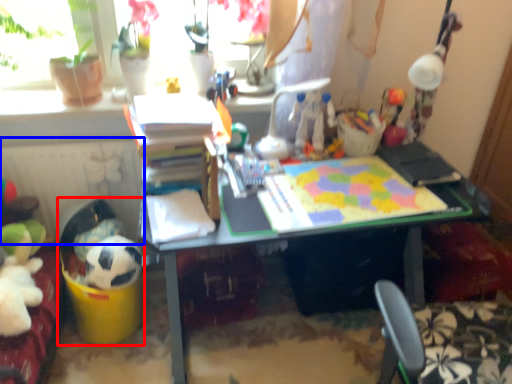
Question: Among these objects, which one is nearest to the camera, toy (highlighted by a red box) or radiator (highlighted by a blue box)?

Choices:
 (A) toy
 (B) radiator

Answer: (A)